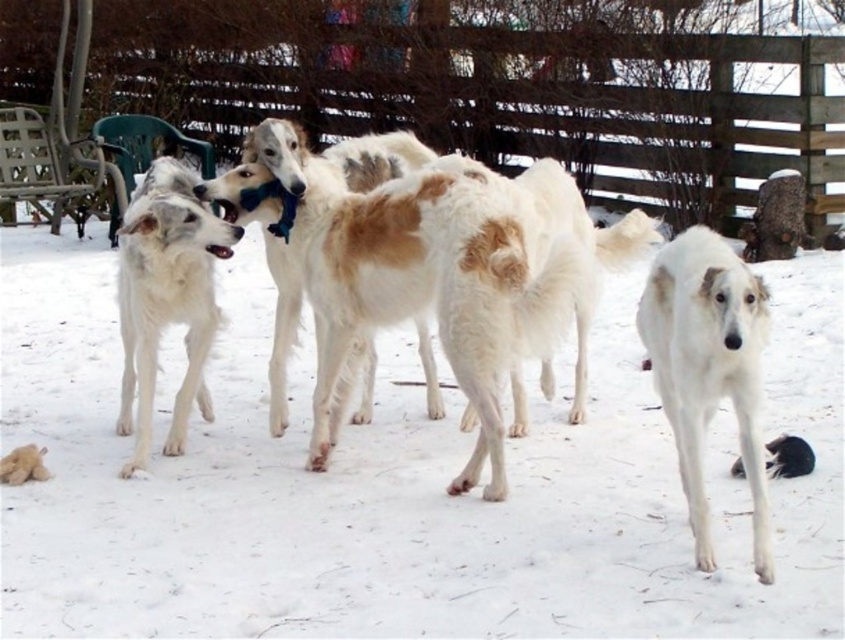
Question: Which point is farther to the camera?

Choices:
 (A) wooden fence at upper center
 (B) white fluffy snow at center
 (C) white fluffy dog at lower right

Answer: (A)

Question: Estimate the real-world distances between objects in this image. Which object is farther from the white fluffy snow at center?

Choices:
 (A) white fluffy dog at lower right
 (B) light brown fur at lower left
 (C) white fur dog at left
 (D) wooden fence at upper center

Answer: (D)

Question: Can you confirm if wooden fence at upper center is wider than white fur dog at left?

Choices:
 (A) yes
 (B) no

Answer: (B)

Question: Can you confirm if white fluffy dog at lower right is positioned below light brown fur at lower left?

Choices:
 (A) no
 (B) yes

Answer: (A)

Question: Is wooden fence at upper center above white fur dog at left?

Choices:
 (A) no
 (B) yes

Answer: (B)

Question: Which of the following is the farthest from the observer?

Choices:
 (A) (1, 477)
 (B) (173, 193)
 (C) (657, 356)

Answer: (A)